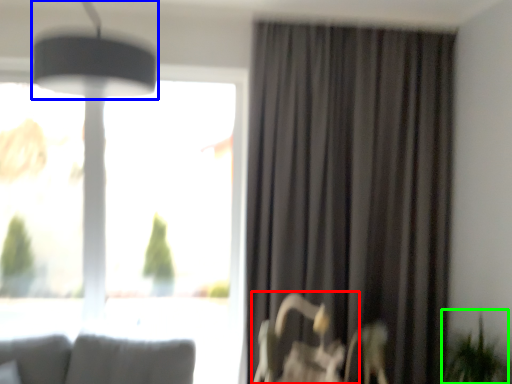
Question: Which object is positioned closest to swivel chair (highlighted by a red box)? Select from lamp (highlighted by a blue box) and plant (highlighted by a green box).

Choices:
 (A) lamp
 (B) plant

Answer: (B)